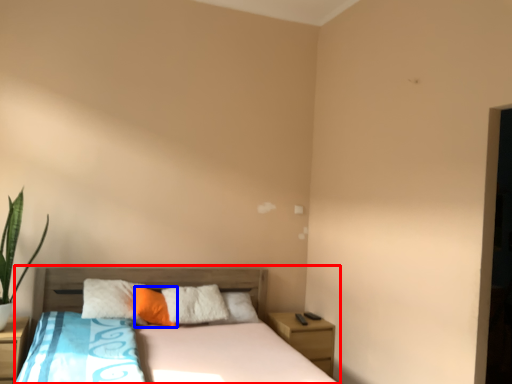
Question: Which object is further to the camera taking this photo, bed (highlighted by a red box) or pillow (highlighted by a blue box)?

Choices:
 (A) bed
 (B) pillow

Answer: (B)